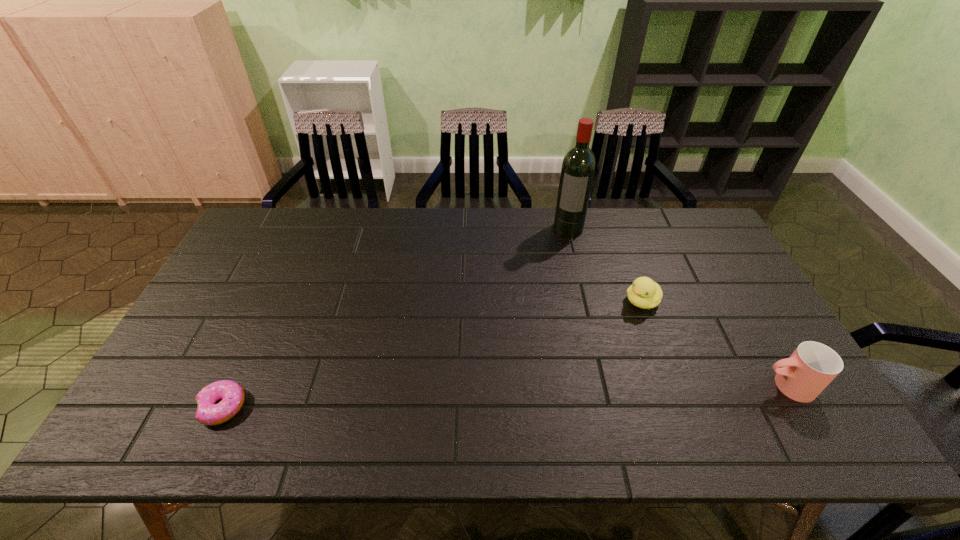
You are a GUI agent. You are given a task and a screenshot of the screen. Output one action in this format:
    pyautogui.click(x=<x>, y=<y>)
    Task: Click on the vacant region located on the side of the second tallest object with the handle
    The image size is (960, 540).
    Given the screenshot: What is the action you would take?
    pyautogui.click(x=621, y=386)

Locate an element on the screen. vacant space located on the side of the second tallest object with the handle is located at coordinates (621, 386).

The image size is (960, 540). What are the coordinates of `free space located on the label of the third object from right to left` in the screenshot? It's located at (544, 309).

Identify the location of vacant space situated on the label of the third object from right to left. [x=560, y=256].

Identify the location of vacant space located on the label of the third object from right to left. (563, 247).

Where is `free space located 0.140m at the beak of the duckling`? free space located 0.140m at the beak of the duckling is located at coordinates (600, 334).

Identify the location of vacant space situated 0.090m at the beak of the duckling. This screenshot has height=540, width=960. (612, 325).

The image size is (960, 540). What are the coordinates of `vacant space located 0.300m at the beak of the duckling` in the screenshot? It's located at (559, 364).

The width and height of the screenshot is (960, 540). Find the location of `object that is at the far edge`. object that is at the far edge is located at coordinates (578, 168).

Identify the location of doughnut present at the near edge. The height and width of the screenshot is (540, 960). (231, 394).